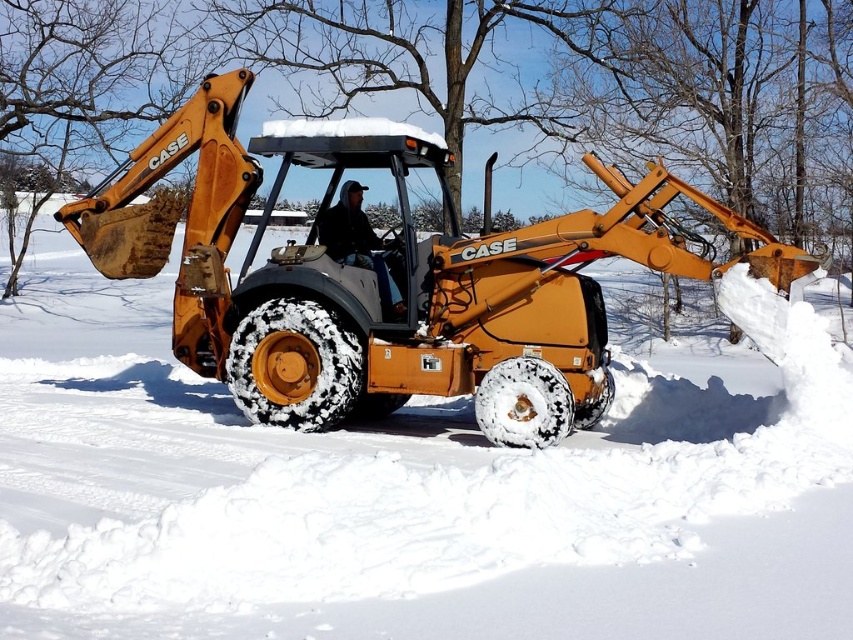
Does matte yellow tractor at center appear on the left side of dark blue jeans at center?

In fact, matte yellow tractor at center is to the right of dark blue jeans at center.

The image size is (853, 640). Identify the location of matte yellow tractor at center. (396, 275).

You are a GUI agent. You are given a task and a screenshot of the screen. Output one action in this format:
    pyautogui.click(x=<x>, y=<y>)
    Task: Click on the matte yellow tractor at center
    
    Given the screenshot: What is the action you would take?
    pyautogui.click(x=396, y=275)